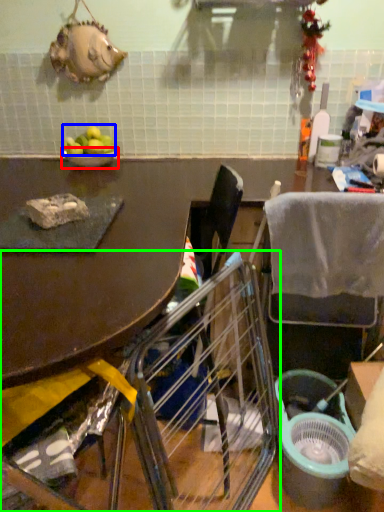
Question: Which object is the closest to the bowl (highlighted by a red box)? Choose among these: fruit (highlighted by a blue box) or chair (highlighted by a green box).

Choices:
 (A) fruit
 (B) chair

Answer: (A)